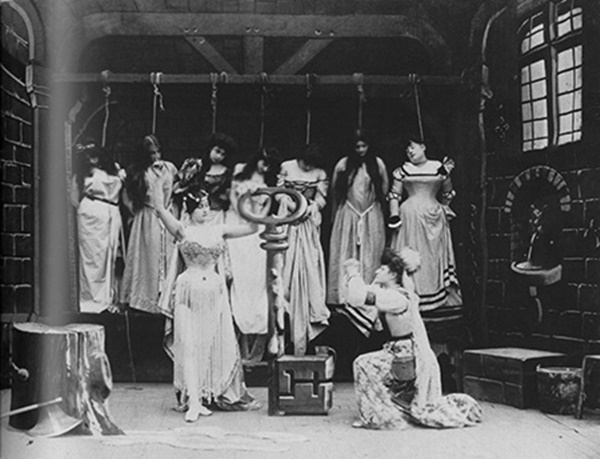
Find the location of `wood box`. wood box is located at coordinates (310, 377).